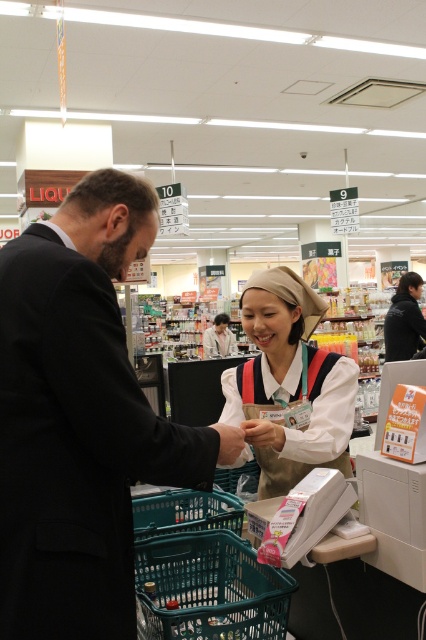
Is black suit at left positioned at the back of white fabric uniform at center?

No, it is in front of white fabric uniform at center.

Does black suit at left have a smaller size compared to white fabric uniform at center?

No.

Locate an element on the screen. The image size is (426, 640). black suit at left is located at coordinates tap(80, 419).

At what (x,y) coordinates should I click in order to perform the action: click on black suit at left. Please return your answer as a coordinate pair (x, y). Looking at the image, I should click on (80, 419).

This screenshot has height=640, width=426. Identify the location of black suit at left. (80, 419).

Is black suit at left below black fabric jacket at upper right?

Yes.

Which is in front, point (92, 237) or point (425, 339)?

Point (92, 237) is in front.

Where is `black suit at left`? The width and height of the screenshot is (426, 640). black suit at left is located at coordinates (80, 419).

I want to click on white fabric uniform at center, so click(288, 385).

Who is positioned more to the left, white fabric uniform at center or black fabric jacket at upper right?

white fabric uniform at center

Does point (345, 420) come farther from viewer compared to point (402, 314)?

That is False.

The height and width of the screenshot is (640, 426). In order to click on white fabric uniform at center in this screenshot , I will do `click(288, 385)`.